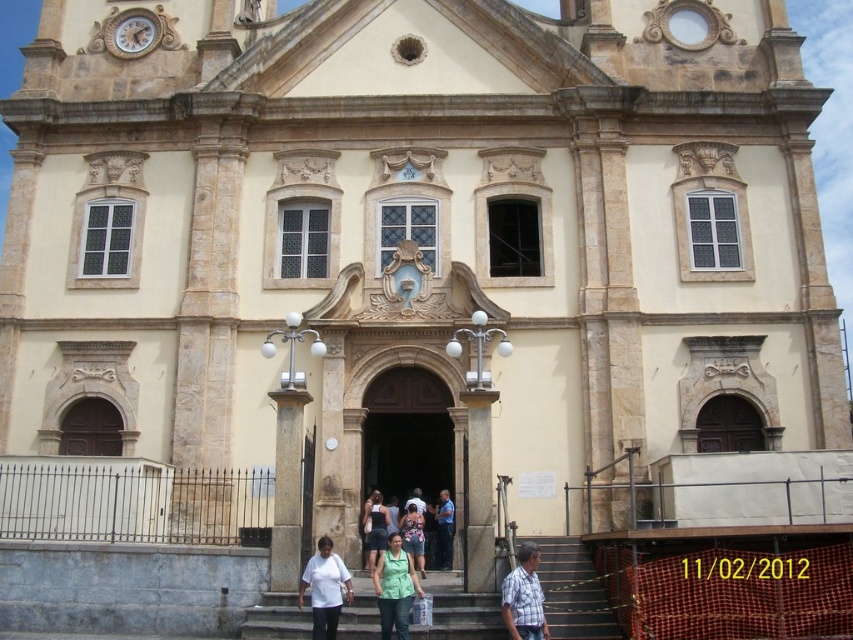
You are standing in front of the historic building and want to know the distance to the point marked at coordinates point (566, 588). Can you estimate how far it is from your current position?

The point (566, 588) is 150.83 feet away from the viewer, so the distance is approximately 150.83 feet.

You are an architect designing a new building inspired by this historic structure. You need to place two statues on the facade. The green matte shirt at center and the plaid cotton shirt at lower right. Which statue should be placed higher to maintain the symmetry of the building?

The plaid cotton shirt at lower right should be placed higher since it is taller than the green matte shirt at center, ensuring that the taller statue aligns with the upper sections of the facade for symmetry.